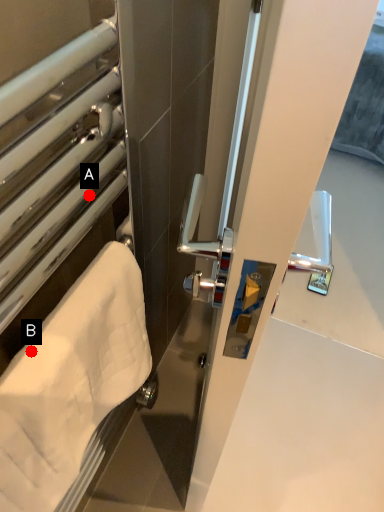
Question: Two points are circled on the image, labeled by A and B beside each circle. Among these points, which one is nearest to the camera?

Choices:
 (A) A is closer
 (B) B is closer

Answer: (B)